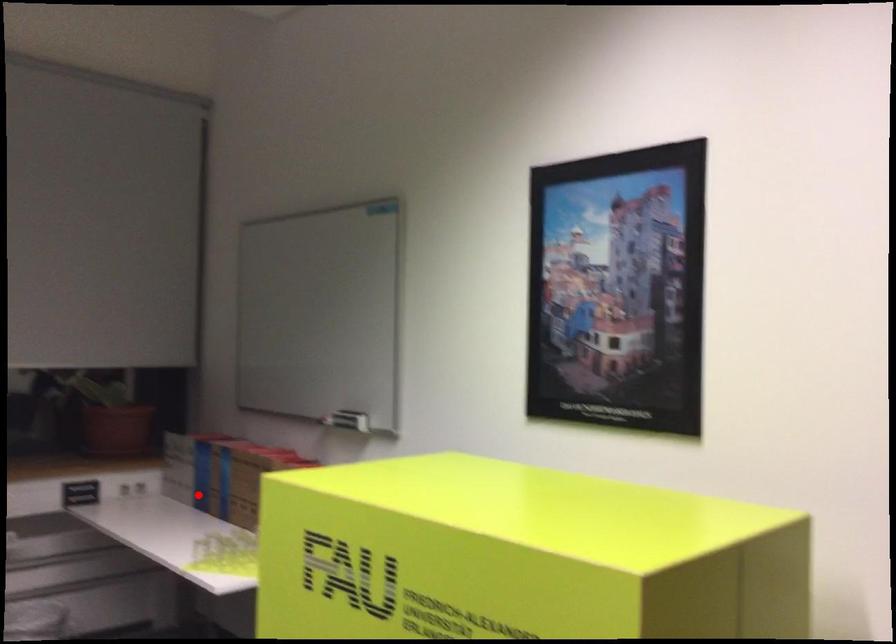
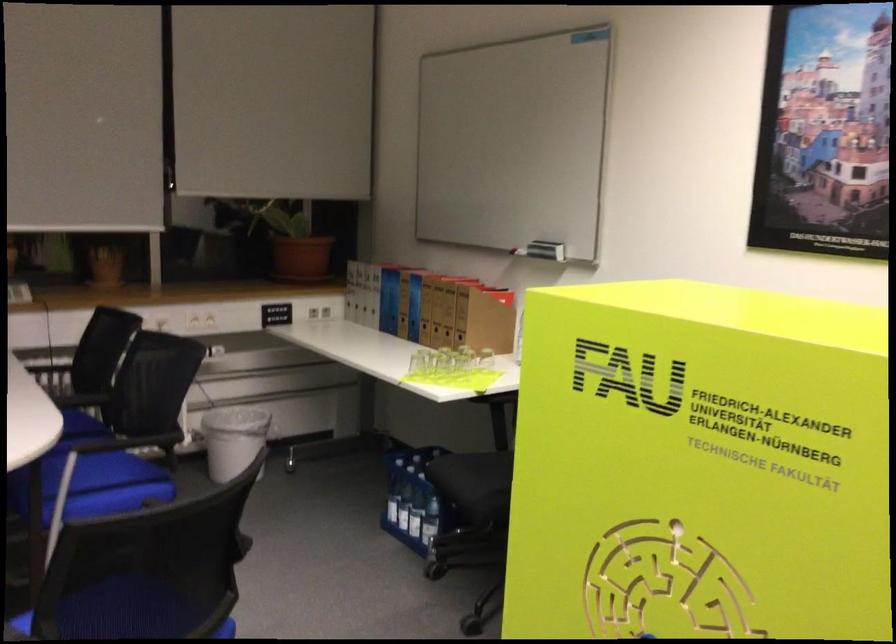
The point at the highlighted location is marked in the first image. Where is the corresponding point in the second image?

(382, 321)